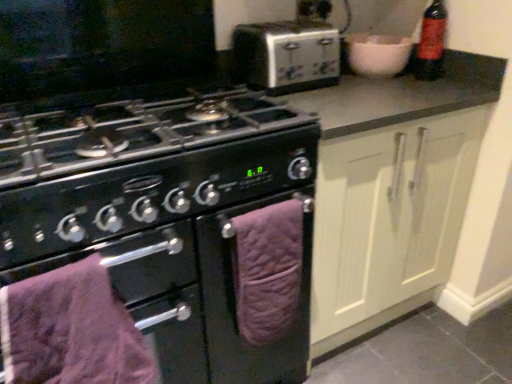
You are a GUI agent. You are given a task and a screenshot of the screen. Output one action in this format:
    pyautogui.click(x=<x>, y=<y>)
    Task: Click on the vacant region to the left of red matte bottle at upper right
    Image resolution: width=512 pixels, height=384 pixels.
    Given the screenshot: What is the action you would take?
    pyautogui.click(x=398, y=82)